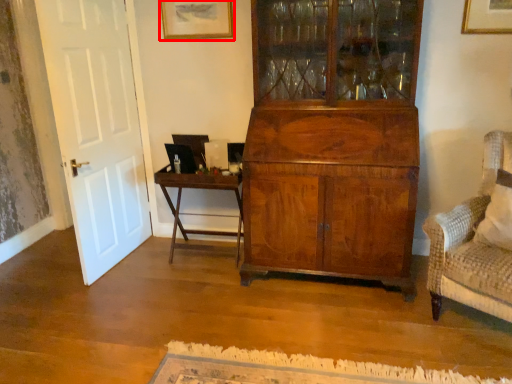
Question: From the image's perspective, what is the correct spatial relationship of picture frame (annotated by the red box) in relation to table?

Choices:
 (A) below
 (B) above

Answer: (B)